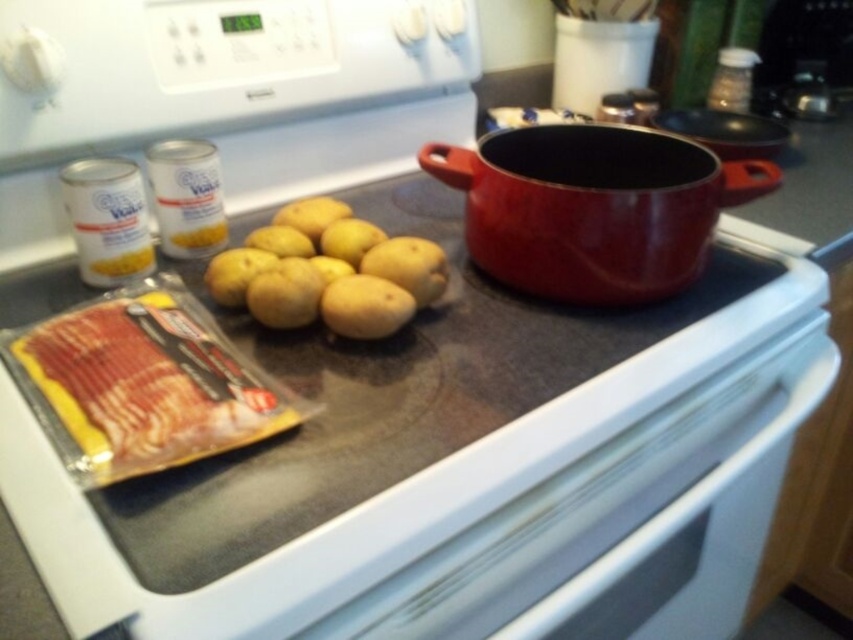
Is point (686, 577) positioned in front of point (715, 168)?

No, it is behind (715, 168).

Is white glossy oven at lower center to the right of matte red pot at center from the viewer's perspective?

Indeed, white glossy oven at lower center is positioned on the right side of matte red pot at center.

The image size is (853, 640). I want to click on white glossy oven at lower center, so click(x=622, y=524).

Identify the location of white glossy oven at lower center. (622, 524).

In the scene shown: Between matte red pot at center and yellow matte potato at center, which one appears on the right side from the viewer's perspective?

Positioned to the right is matte red pot at center.

Describe the element at coordinates (593, 208) in the screenshot. I see `matte red pot at center` at that location.

Does point (546, 148) lie behind point (372, 305)?

Yes.

Locate an element on the screen. This screenshot has height=640, width=853. matte red pot at center is located at coordinates (593, 208).

Is point (621, 508) behind point (347, 282)?

No.

Which is above, white glossy oven at lower center or yellow matte potato at center?

yellow matte potato at center

Who is more forward, (744, 429) or (344, 314)?

Positioned in front is point (344, 314).

In order to click on white glossy oven at lower center in this screenshot , I will do `click(622, 524)`.